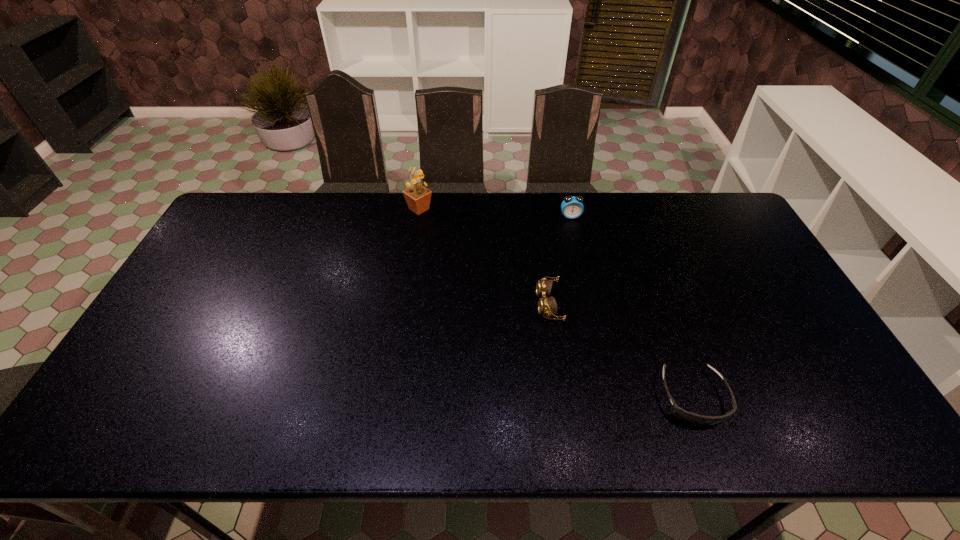
Where is `sunflower`? The width and height of the screenshot is (960, 540). sunflower is located at coordinates (418, 197).

Identify the location of the tallest object. The image size is (960, 540). (418, 197).

Find the location of `alarm clock`. alarm clock is located at coordinates (572, 207).

Where is `the third object from left to right`? the third object from left to right is located at coordinates (572, 207).

This screenshot has width=960, height=540. I want to click on the farther goggles, so click(x=547, y=306).

The width and height of the screenshot is (960, 540). I want to click on the second nearest object, so coord(547,306).

This screenshot has height=540, width=960. What are the coordinates of `the right goggles` in the screenshot? It's located at (695, 419).

Image resolution: width=960 pixels, height=540 pixels. In order to click on the rightmost object in this screenshot , I will do `click(695, 419)`.

Where is `free space located 0.100m at the front of the leftmost object with flowers visible`? This screenshot has width=960, height=540. free space located 0.100m at the front of the leftmost object with flowers visible is located at coordinates coord(462,209).

In order to click on blank space located on the face of the third object from left to right in this screenshot , I will do `click(587, 285)`.